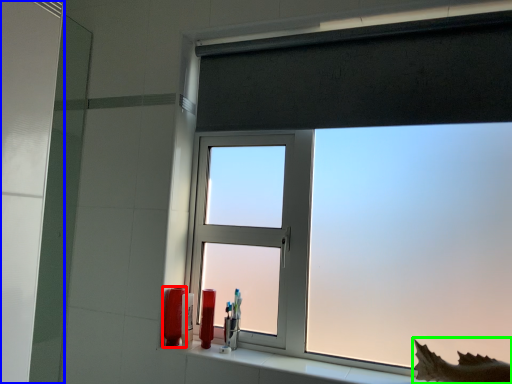
Question: Which is nearer to the toiletry (highlighted by a red box)? screen door (highlighted by a blue box) or animal (highlighted by a green box).

Choices:
 (A) screen door
 (B) animal

Answer: (A)